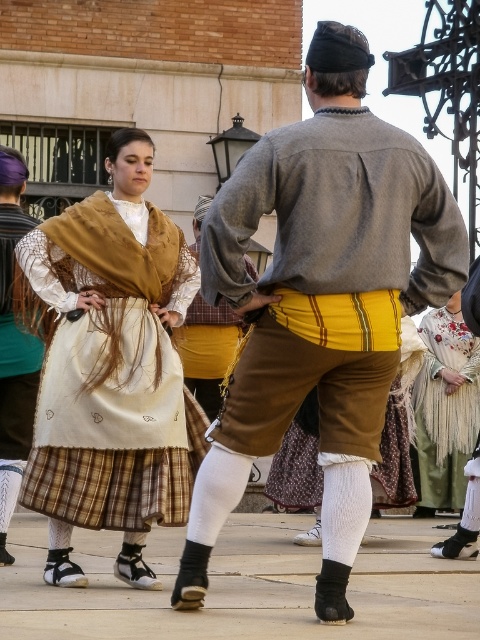
Question: Does matte gray sweater at center lie in front of matte brown fabric dress at center?

Choices:
 (A) yes
 (B) no

Answer: (A)

Question: Does matte brown leather belt at center come in front of yellow cotton shirt at center?

Choices:
 (A) no
 (B) yes

Answer: (A)

Question: Does matte gray sweater at center have a lesser width compared to matte brown fabric dress at center?

Choices:
 (A) yes
 (B) no

Answer: (B)

Question: Which point appears closest to the camera in this image?

Choices:
 (A) (435, 376)
 (B) (70, 282)
 (C) (200, 362)

Answer: (B)

Question: Based on their relative distances, which object is farther from the matte brown fabric dress at center?

Choices:
 (A) matte gray sweater at center
 (B) embroidered silk dress at center

Answer: (B)

Question: Which point is closer to the camera taking this photo?

Choices:
 (A) (170, 454)
 (B) (187, 380)
 (C) (215, 442)
 (D) (14, 236)

Answer: (C)